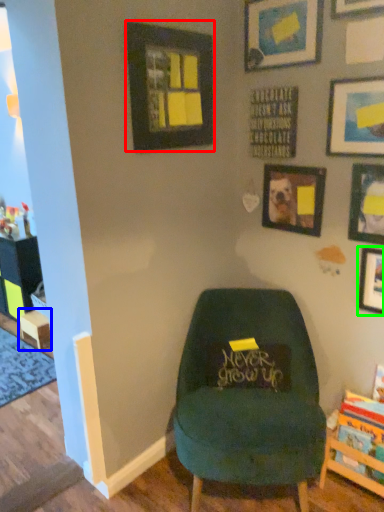
Question: Based on their relative distances, which object is farther from picture frame (highlighted by a red box)? Choose from table (highlighted by a blue box) and picture frame (highlighted by a green box).

Choices:
 (A) table
 (B) picture frame

Answer: (A)